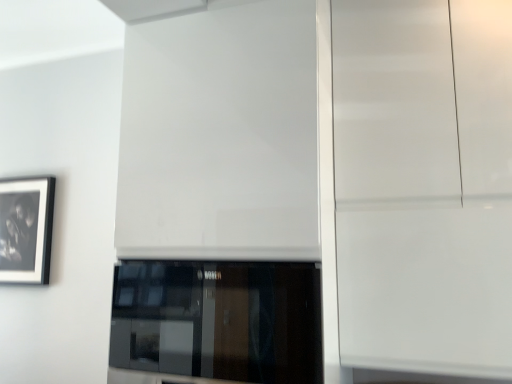
Question: From a real-world perspective, is white glossy door at center under black matte picture frame at left?

Choices:
 (A) yes
 (B) no

Answer: (B)

Question: Would you consider white glossy door at center to be distant from black matte picture frame at left?

Choices:
 (A) yes
 (B) no

Answer: (A)

Question: Does white glossy door at center have a greater width compared to black matte picture frame at left?

Choices:
 (A) no
 (B) yes

Answer: (B)

Question: From the image's perspective, does white glossy door at center appear lower than black matte picture frame at left?

Choices:
 (A) yes
 (B) no

Answer: (B)

Question: Considering the relative positions of white glossy door at center and black matte picture frame at left in the image provided, is white glossy door at center to the left of black matte picture frame at left from the viewer's perspective?

Choices:
 (A) no
 (B) yes

Answer: (A)

Question: Is black matte picture frame at left taller or shorter than glossy white cabinet at right?

Choices:
 (A) tall
 (B) short

Answer: (B)

Question: Considering the positions of black matte picture frame at left and glossy white cabinet at right in the image, is black matte picture frame at left wider or thinner than glossy white cabinet at right?

Choices:
 (A) thin
 (B) wide

Answer: (A)

Question: In the image, is black matte picture frame at left on the left side or the right side of glossy white cabinet at right?

Choices:
 (A) left
 (B) right

Answer: (A)

Question: In terms of size, does black matte picture frame at left appear bigger or smaller than glossy white cabinet at right?

Choices:
 (A) big
 (B) small

Answer: (B)

Question: In the image, is white glossy door at center on the left side or the right side of black glass window at center?

Choices:
 (A) right
 (B) left

Answer: (B)

Question: Considering the positions of white glossy door at center and black glass window at center in the image, is white glossy door at center wider or thinner than black glass window at center?

Choices:
 (A) wide
 (B) thin

Answer: (B)

Question: Is point (185, 196) closer or farther from the camera than point (136, 329)?

Choices:
 (A) closer
 (B) farther

Answer: (B)

Question: From the image's perspective, is white glossy door at center positioned above or below black glass window at center?

Choices:
 (A) below
 (B) above

Answer: (B)

Question: Based on their positions, is glossy white cabinet at right located to the left or right of black glass window at center?

Choices:
 (A) right
 (B) left

Answer: (A)

Question: Is point (482, 228) closer or farther from the camera than point (124, 347)?

Choices:
 (A) farther
 (B) closer

Answer: (B)